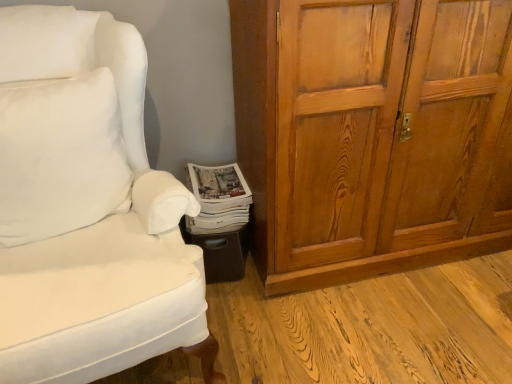
Question: Should I look upward or downward to see white fabric chair at lower left?

Choices:
 (A) up
 (B) down

Answer: (B)

Question: Is wooden cabinet at right bigger than white glossy magazine at lower center?

Choices:
 (A) no
 (B) yes

Answer: (B)

Question: From a real-world perspective, is wooden cabinet at right under white glossy magazine at lower center?

Choices:
 (A) yes
 (B) no

Answer: (B)

Question: Is white glossy magazine at lower center completely or partially inside wooden cabinet at right?

Choices:
 (A) yes
 (B) no

Answer: (B)

Question: Is wooden cabinet at right in front of white glossy magazine at lower center?

Choices:
 (A) no
 (B) yes

Answer: (B)

Question: Is wooden cabinet at right not inside white glossy magazine at lower center?

Choices:
 (A) no
 (B) yes

Answer: (B)

Question: Considering the relative sizes of wooden cabinet at right and white glossy magazine at lower center in the image provided, is wooden cabinet at right wider than white glossy magazine at lower center?

Choices:
 (A) no
 (B) yes

Answer: (B)

Question: From the image's perspective, is white fabric chair at lower left located beneath white glossy magazine at lower center?

Choices:
 (A) yes
 (B) no

Answer: (A)

Question: Can you confirm if white fabric chair at lower left is taller than white glossy magazine at lower center?

Choices:
 (A) no
 (B) yes

Answer: (B)

Question: Does white fabric chair at lower left have a larger size compared to white glossy magazine at lower center?

Choices:
 (A) no
 (B) yes

Answer: (B)

Question: Does white fabric chair at lower left have a lesser height compared to white glossy magazine at lower center?

Choices:
 (A) yes
 (B) no

Answer: (B)

Question: Is white fabric chair at lower left wider than white glossy magazine at lower center?

Choices:
 (A) no
 (B) yes

Answer: (B)

Question: Is white fabric chair at lower left surrounding white glossy magazine at lower center?

Choices:
 (A) no
 (B) yes

Answer: (A)

Question: Is wooden cabinet at right aimed at white fabric chair at lower left?

Choices:
 (A) yes
 (B) no

Answer: (B)